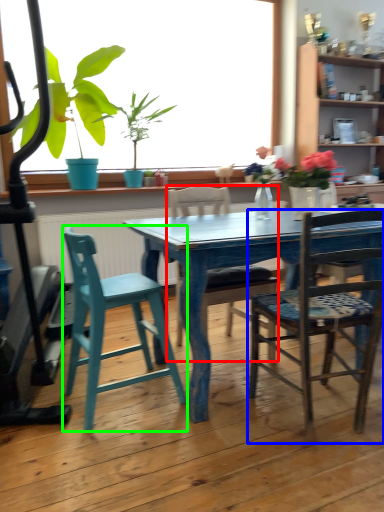
Question: Based on their relative distances, which object is nearer to chair (highlighted by a red box)? Choose from chair (highlighted by a blue box) and chair (highlighted by a green box).

Choices:
 (A) chair
 (B) chair

Answer: (A)